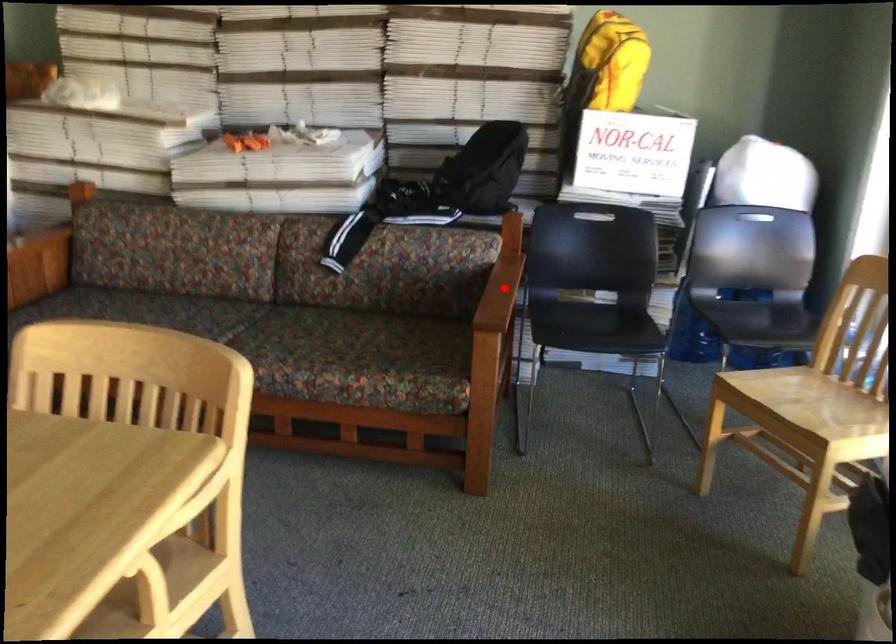
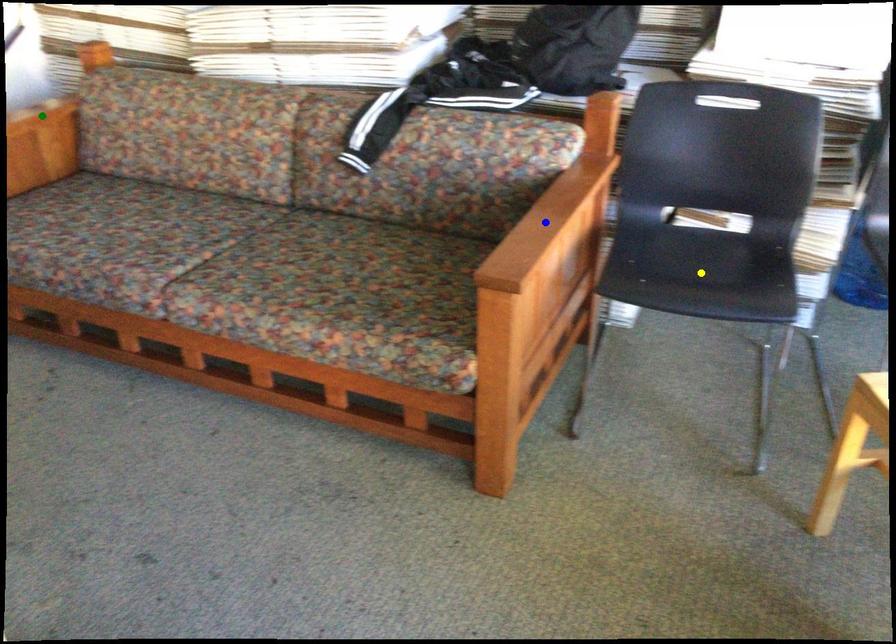
Question: I am providing you with two images of the same scene from different viewpoints. A red point is marked on the first image. You are given multiple points on the second image. Which spot in image 2 lines up with the point in image 1?

Choices:
 (A) green point
 (B) blue point
 (C) yellow point

Answer: (B)